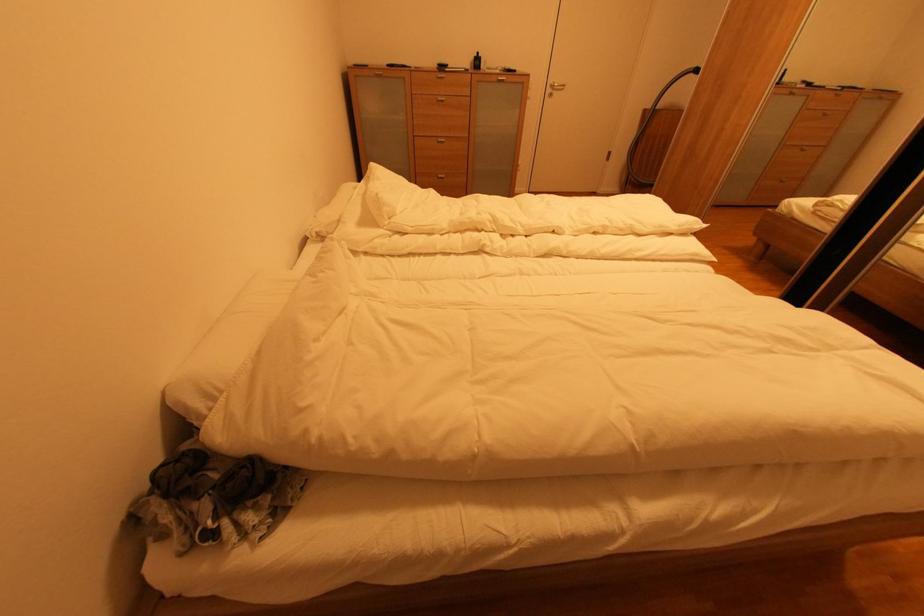
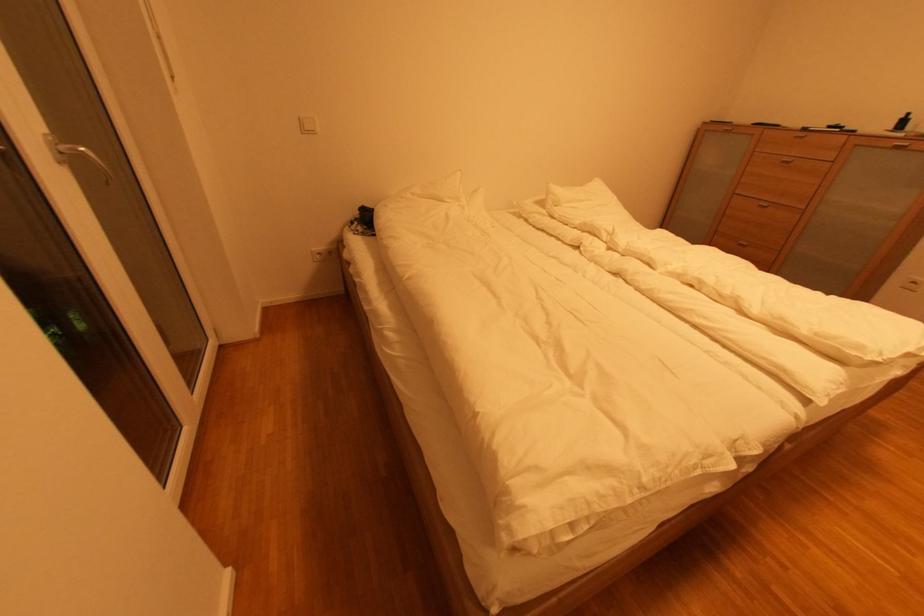
Where in the second image is the point corresponding to point 450,143 from the first image?

(772, 208)